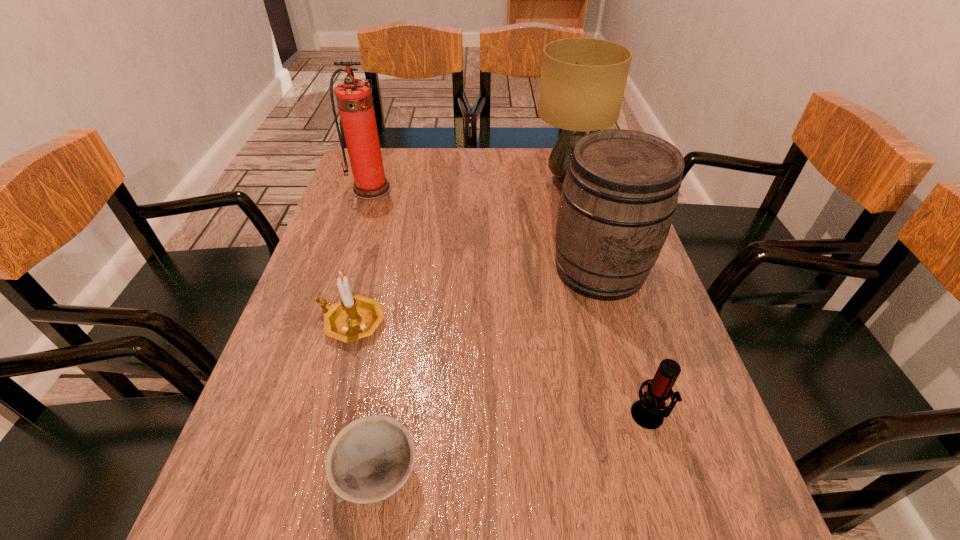
Identify the location of lampshade. (583, 80).

Locate an element on the screen. Image resolution: width=960 pixels, height=540 pixels. fire extinguisher is located at coordinates (354, 99).

What are the coordinates of `the third tallest object` in the screenshot? It's located at (618, 199).

Identify the location of candle holder. This screenshot has width=960, height=540. (355, 317).

The width and height of the screenshot is (960, 540). In order to click on microphone in this screenshot , I will do `click(647, 412)`.

Locate an element on the screen. the nearest object is located at coordinates (370, 459).

The image size is (960, 540). What are the coordinates of `the shortest object` in the screenshot? It's located at (370, 459).

Locate an element on the screen. free space located on the left of the lampshade is located at coordinates (x=449, y=179).

I want to click on blank space located at the discharge end of the fire extinguisher, so click(x=347, y=266).

Where is `vacant position located 0.290m on the front of the wine bucket`? The image size is (960, 540). vacant position located 0.290m on the front of the wine bucket is located at coordinates (645, 425).